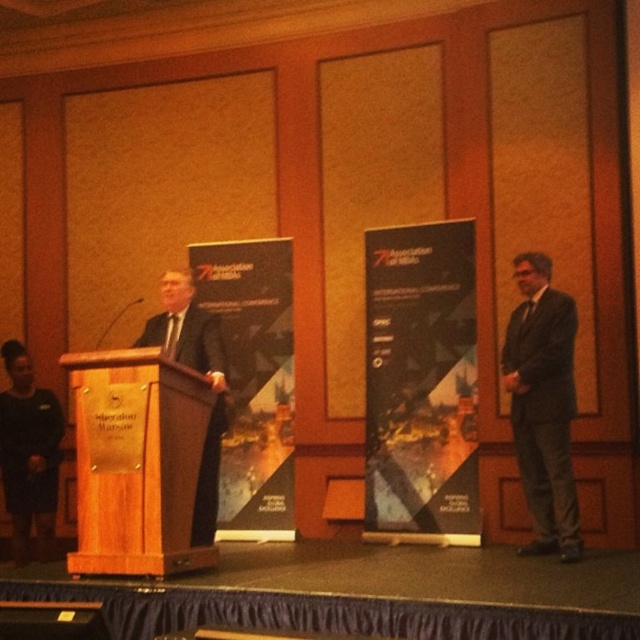
Between wooden podium at left and matte black suit at left, which one has more height?

Standing taller between the two is matte black suit at left.

Is wooden podium at left wider than matte black suit at left?

Yes, wooden podium at left is wider than matte black suit at left.

Who is more forward, (115, 470) or (180, 280)?

Point (115, 470) is more forward.

The width and height of the screenshot is (640, 640). In order to click on wooden podium at left in this screenshot , I will do `click(136, 461)`.

Does wooden podium at left appear on the right side of black suit at left?

Indeed, wooden podium at left is positioned on the right side of black suit at left.

Does wooden podium at left have a larger size compared to black suit at left?

No.

Find the location of a particular element. wooden podium at left is located at coordinates (136, 461).

Does point (58, 440) come in front of point (208, 541)?

No, (58, 440) is further to viewer.

Can you confirm if black suit at left is positioned above matte black suit at left?

→ Incorrect, black suit at left is not positioned above matte black suit at left.

The height and width of the screenshot is (640, 640). What do you see at coordinates (28, 452) in the screenshot?
I see `black suit at left` at bounding box center [28, 452].

Image resolution: width=640 pixels, height=640 pixels. In order to click on black suit at left in this screenshot , I will do `click(28, 452)`.